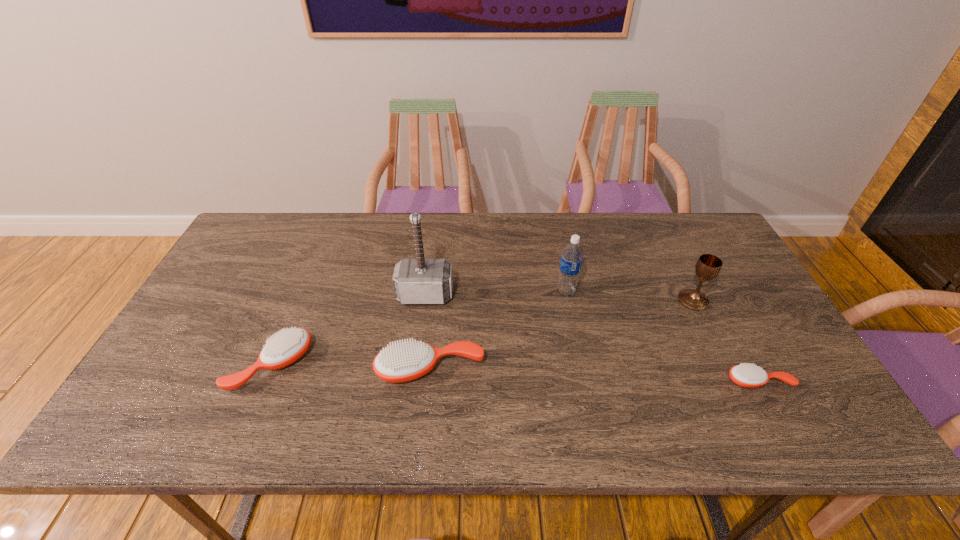
Find the location of a particular element. The image size is (960, 540). vacant space situated 0.340m on the right of the second hairbrush from right to left is located at coordinates (624, 370).

Locate an element on the screen. free space located 0.270m on the back of the rightmost hairbrush is located at coordinates (710, 292).

This screenshot has width=960, height=540. Identify the location of vacant space located 0.080m on the left of the fourth shortest object. (650, 300).

Identify the location of vacant space located on the right of the second tallest object. The image size is (960, 540). (635, 291).

The width and height of the screenshot is (960, 540). Identify the location of vacant space situated 0.270m for striking with the head of the hammer. (413, 392).

Identify the location of hairbrush situated at the right edge. This screenshot has width=960, height=540. (750, 376).

Identify the location of chalice that is positioned at the right edge. (708, 266).

The width and height of the screenshot is (960, 540). Identify the location of object that is at the near right corner. (750, 376).

The height and width of the screenshot is (540, 960). Identify the location of blank area at the far edge. click(312, 256).

In the image, there is a desktop. Where is `vacant space at the left edge`? vacant space at the left edge is located at coordinates (228, 309).